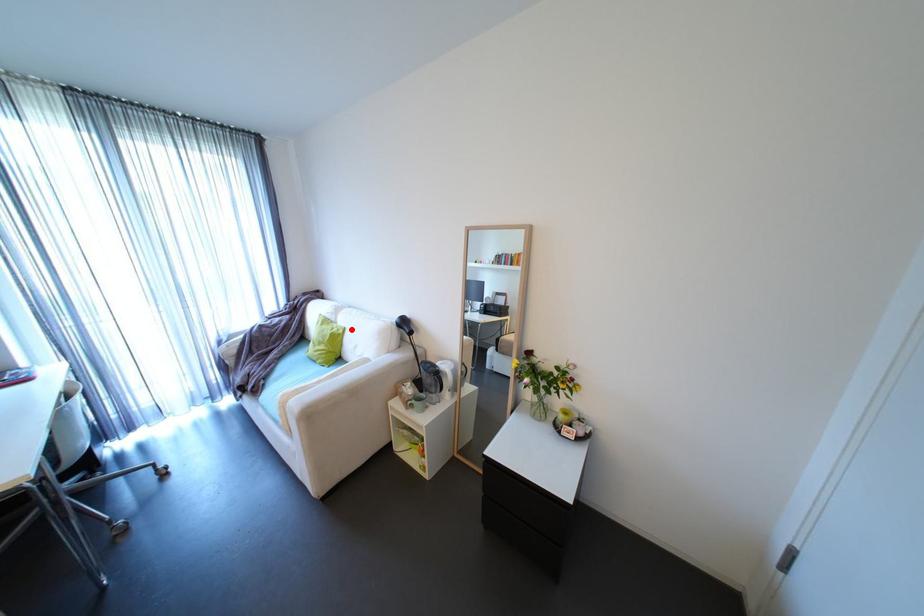
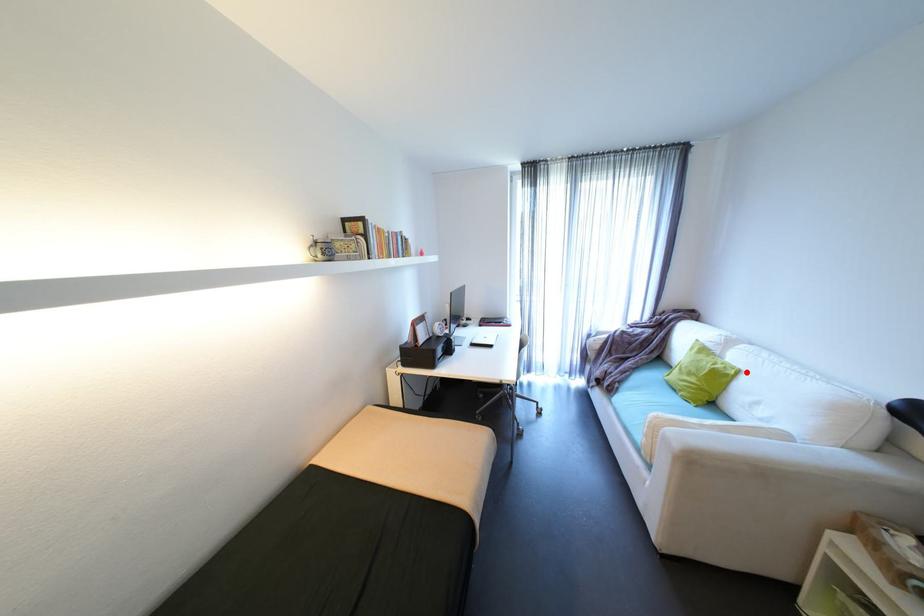
I am providing you with two images of the same scene from different viewpoints. A red point is marked on the first image and another point is marked on the second image. Is the marked point in image1 the same physical position as the marked point in image2?

Yes